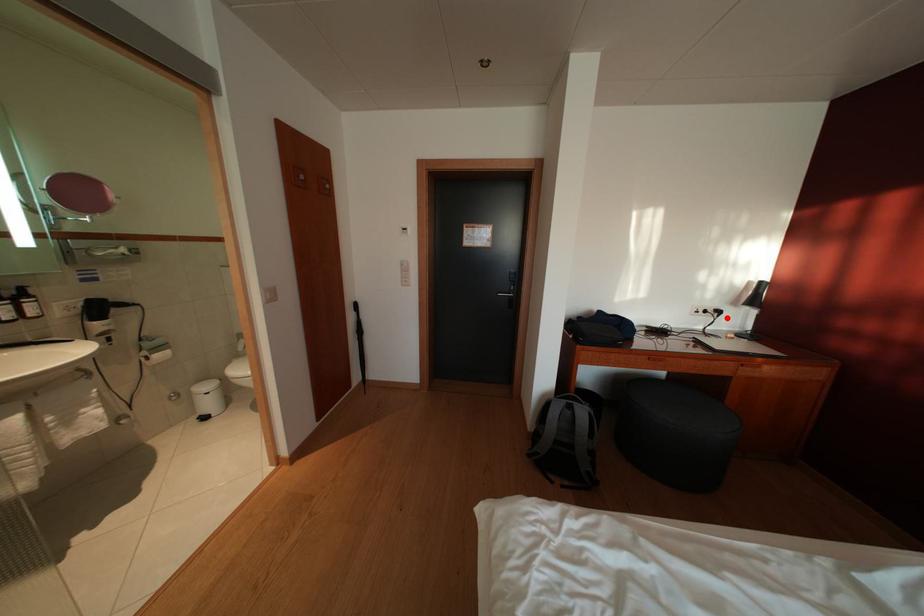
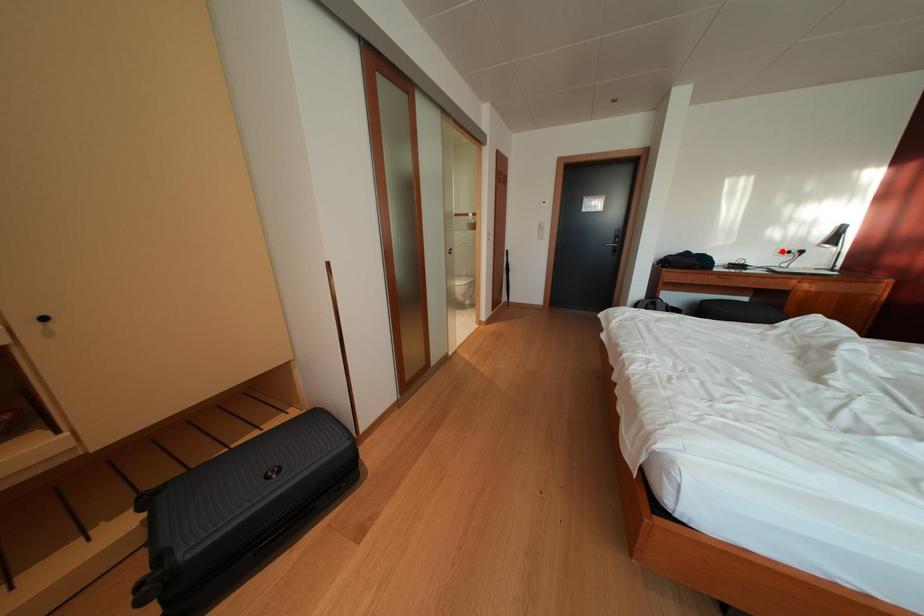
I am providing you with two images of the same scene from different viewpoints. A red point is marked on the first image and another point is marked on the second image. Are the points marked in image1 and image2 representing the same 3D position?

No